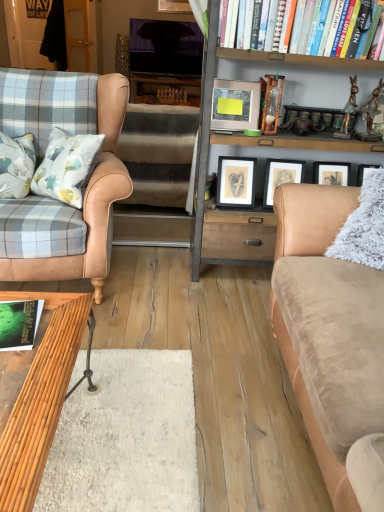
You are a GUI agent. You are given a task and a screenshot of the screen. Output one action in this format:
    pyautogui.click(x=<x>, y=<y>)
    Task: Click on the vacant space to the right of green matte book at lower left, positioned as the first book in front-to-back order
    
    Given the screenshot: What is the action you would take?
    pyautogui.click(x=59, y=338)